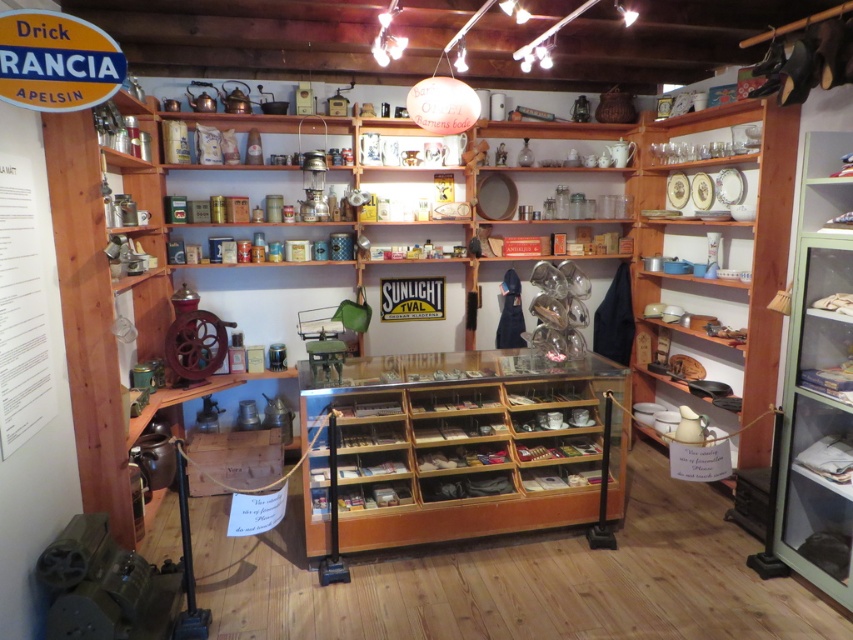
Is wooden display case at center closer to the viewer compared to green glass cabinet at right?

No.

Between wooden display case at center and green glass cabinet at right, which one is positioned higher?

green glass cabinet at right is higher up.

Image resolution: width=853 pixels, height=640 pixels. Describe the element at coordinates (463, 444) in the screenshot. I see `wooden display case at center` at that location.

The height and width of the screenshot is (640, 853). Identify the location of wooden display case at center. (463, 444).